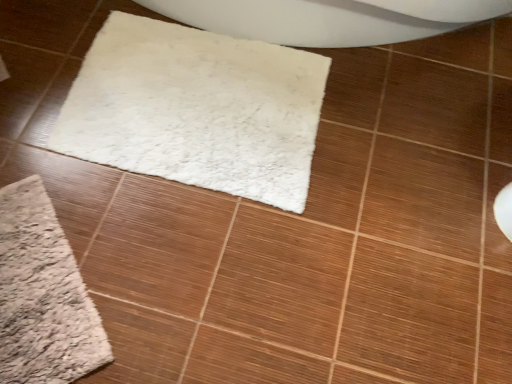
I want to click on free spot below beige fuzzy bath mat at lower left (from a real-world perspective), so click(x=37, y=284).